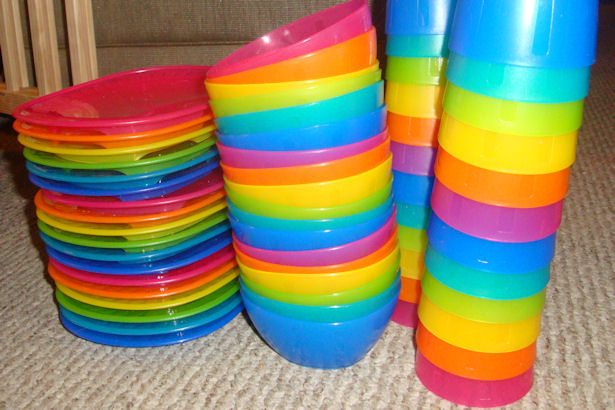
Find the location of `couch`. couch is located at coordinates (199, 28).